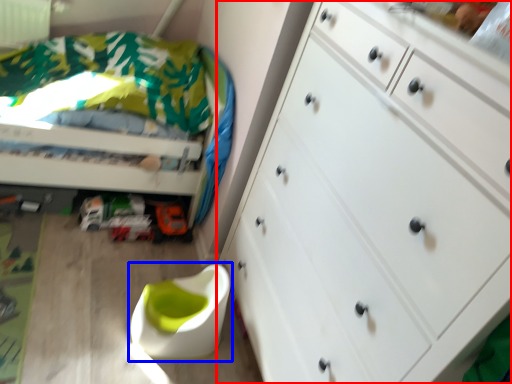
Question: Which object appears farthest to the camera in this image, chest of drawers (highlighted by a red box) or swivel chair (highlighted by a blue box)?

Choices:
 (A) chest of drawers
 (B) swivel chair

Answer: (B)